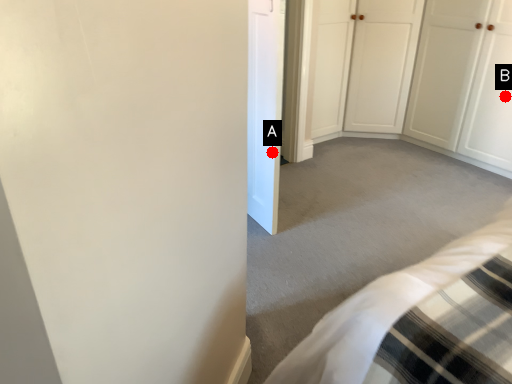
Question: Two points are circled on the image, labeled by A and B beside each circle. Which of the following is the closest to the observer?

Choices:
 (A) A is closer
 (B) B is closer

Answer: (A)